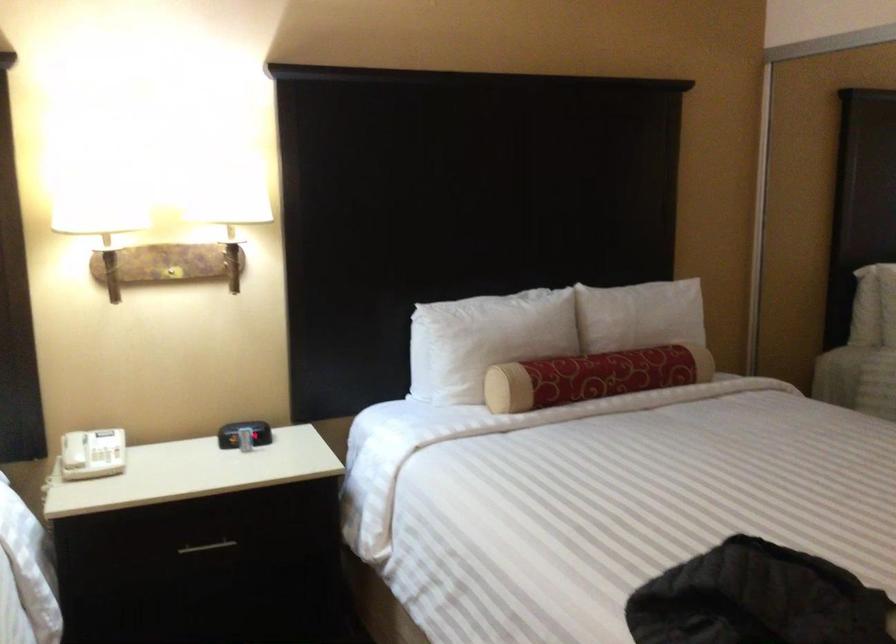
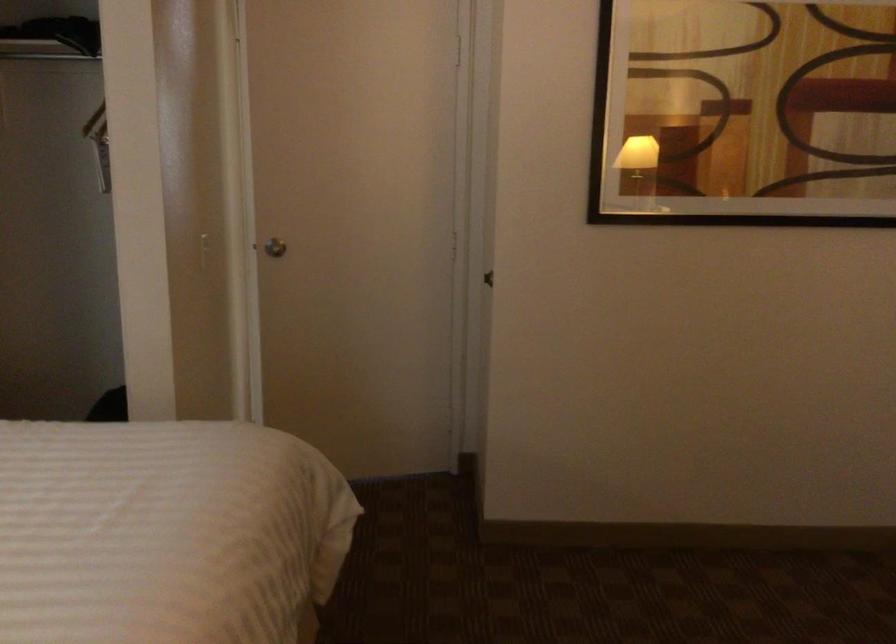
Question: The camera is either moving clockwise (left) or counter-clockwise (right) around the object. The first image is from the beginning of the video and the second image is from the end. Is the camera moving left or right when shooting the video?

Choices:
 (A) Left
 (B) Right

Answer: (A)